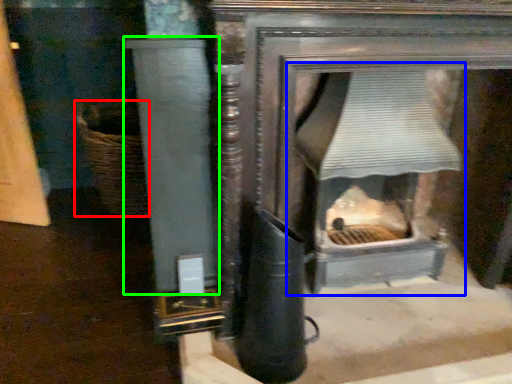
Question: Which is nearer to the basket (highlighted by a red box)? fireplace (highlighted by a blue box) or pillar (highlighted by a green box).

Choices:
 (A) fireplace
 (B) pillar

Answer: (B)